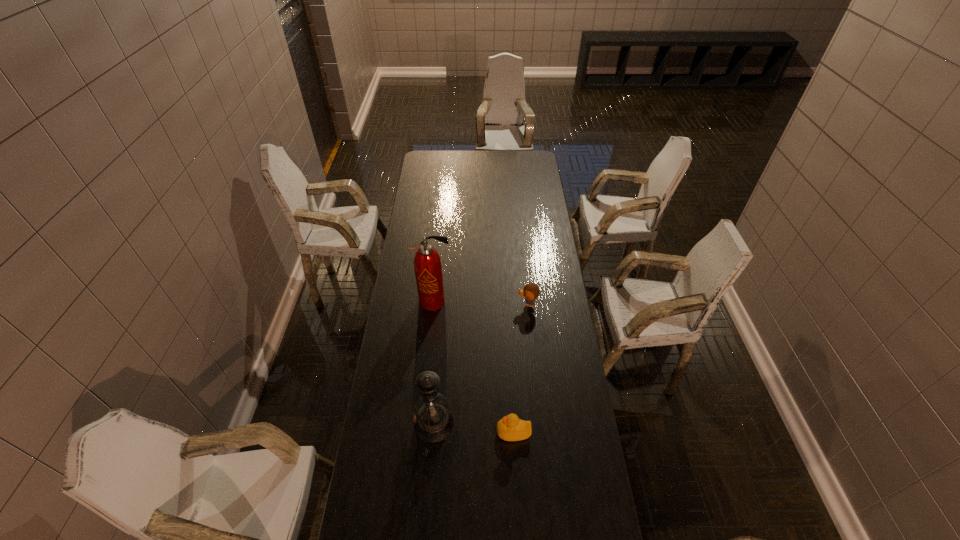
Find the location of a particular element. The width and height of the screenshot is (960, 540). vacant area located 0.370m on the face of the nearer duck is located at coordinates (390, 432).

The height and width of the screenshot is (540, 960). In order to click on vacant position located 0.400m on the face of the nearer duck in this screenshot , I will do `click(381, 432)`.

I want to click on fire extinguisher located at the left edge, so [x=427, y=263].

At what (x,y) coordinates should I click in order to perform the action: click on oil lamp positioned at the left edge. Please return your answer as a coordinate pair (x, y). Looking at the image, I should click on (433, 422).

Locate an element on the screen. The image size is (960, 540). object that is at the right edge is located at coordinates (531, 291).

Where is `vacant space at the far edge`? vacant space at the far edge is located at coordinates (511, 171).

Locate an element on the screen. The width and height of the screenshot is (960, 540). vacant space at the left edge is located at coordinates (392, 418).

Where is `free spot at the right edge of the desktop`? This screenshot has height=540, width=960. free spot at the right edge of the desktop is located at coordinates (552, 312).

The height and width of the screenshot is (540, 960). In order to click on vacant space at the far left corner of the desktop in this screenshot , I will do `click(420, 153)`.

What are the coordinates of `blank space at the far right corner of the desktop` in the screenshot? It's located at (514, 151).